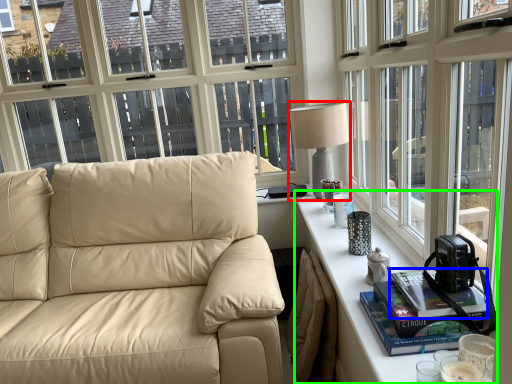
Question: Considering the real-world distances, which object is farthest from table lamp (highlighted by a red box)? book (highlighted by a blue box) or table (highlighted by a green box)?

Choices:
 (A) book
 (B) table

Answer: (A)